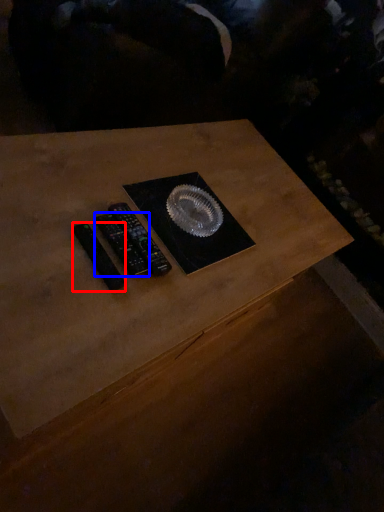
Question: Which point is further to the camera, control (highlighted by a red box) or control (highlighted by a blue box)?

Choices:
 (A) control
 (B) control

Answer: (B)